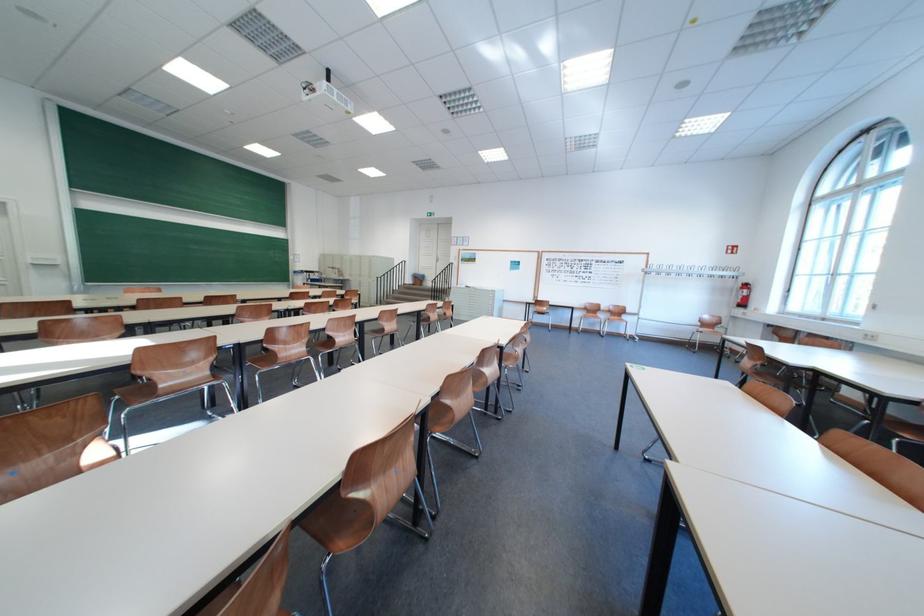
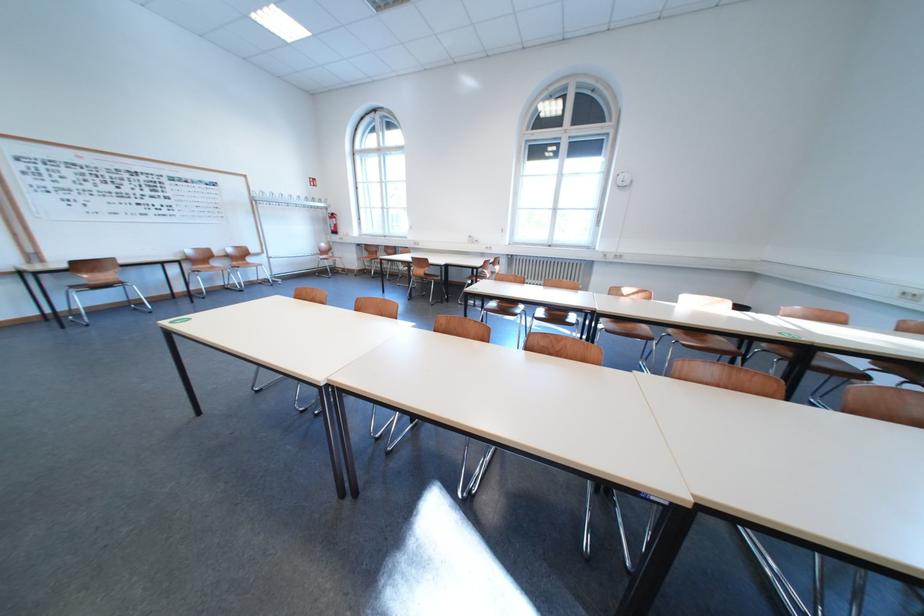
The point at [626,320] is marked in the first image. Where is the corresponding point in the second image?

(249, 265)